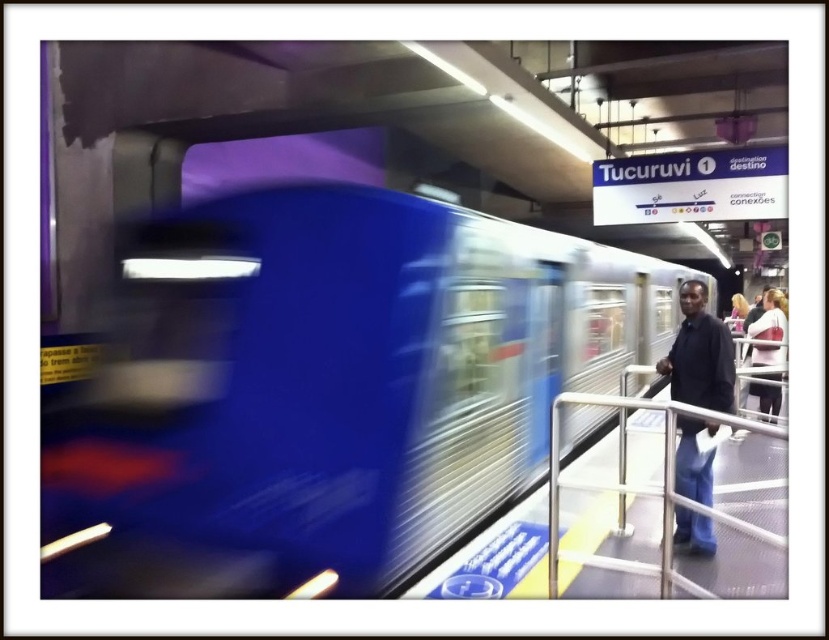
Which is behind, point (681, 480) or point (752, 352)?

Point (752, 352)

What do you see at coordinates (701, 355) in the screenshot? The width and height of the screenshot is (829, 640). I see `dark blue jeans at right` at bounding box center [701, 355].

You are a GUI agent. You are given a task and a screenshot of the screen. Output one action in this format:
    pyautogui.click(x=<x>, y=<y>)
    Task: Click on the dark blue jeans at right
    Image resolution: width=829 pixels, height=640 pixels.
    Given the screenshot: What is the action you would take?
    pyautogui.click(x=701, y=355)

You are a GUI agent. You are given a task and a screenshot of the screen. Output one action in this format:
    pyautogui.click(x=<x>, y=<y>)
    Task: Click on the dark blue jeans at right
    This screenshot has width=829, height=640.
    Given the screenshot: What is the action you would take?
    pyautogui.click(x=701, y=355)

The width and height of the screenshot is (829, 640). What are the coordinates of `metallic silver railing at right` in the screenshot? It's located at (642, 493).

Locate an element on the screen. The image size is (829, 640). metallic silver railing at right is located at coordinates (642, 493).

Who is positioned more to the left, metallic blue train at center or dark blue jeans at right?

metallic blue train at center is more to the left.

Image resolution: width=829 pixels, height=640 pixels. In order to click on metallic blue train at center in this screenshot , I will do coord(325,388).

Between point (272, 400) and point (701, 314), which one is positioned behind?

The point (701, 314) is more distant.

Locate an element on the screen. This screenshot has width=829, height=640. metallic blue train at center is located at coordinates (325, 388).